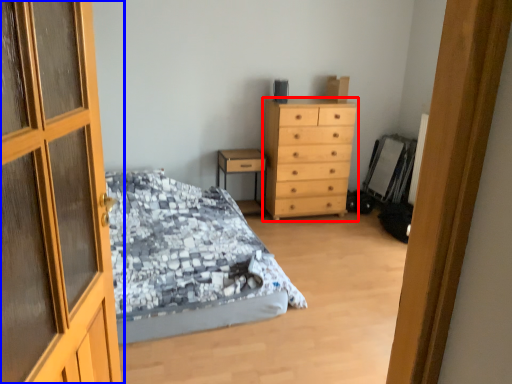
Question: Which of the following is the closest to the observer, chest of drawers (highlighted by a red box) or door (highlighted by a blue box)?

Choices:
 (A) chest of drawers
 (B) door

Answer: (B)